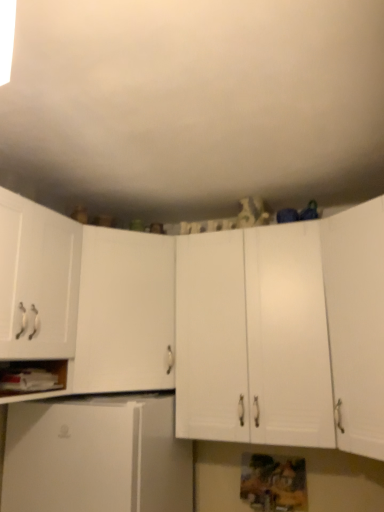
Question: Does white matte cabinet at lower left have a greater width compared to white matte cabinet at left, the third cabinetry from the left?

Choices:
 (A) no
 (B) yes

Answer: (A)

Question: Is white matte cabinet at lower left outside white matte cabinet at left, the third cabinetry from the left?

Choices:
 (A) yes
 (B) no

Answer: (A)

Question: Can you confirm if white matte cabinet at lower left is thinner than white matte cabinet at left, which ranks as the 3th cabinetry in right-to-left order?

Choices:
 (A) yes
 (B) no

Answer: (A)

Question: Is white matte cabinet at lower left closer to the viewer compared to white matte cabinet at left, which ranks as the 3th cabinetry in right-to-left order?

Choices:
 (A) yes
 (B) no

Answer: (A)

Question: Is white matte cabinet at lower left further to the viewer compared to white matte cabinet at left, the third cabinetry from the left?

Choices:
 (A) no
 (B) yes

Answer: (A)

Question: From the image's perspective, relative to white matte cabinet at left, placed as the first cabinetry when sorted from left to right, is white matte cabinet at right, marked as the 5th cabinetry in a left-to-right arrangement, above or below?

Choices:
 (A) above
 (B) below

Answer: (B)

Question: Is white matte cabinet at right, marked as the 5th cabinetry in a left-to-right arrangement, inside the boundaries of white matte cabinet at left, placed as the first cabinetry when sorted from left to right, or outside?

Choices:
 (A) outside
 (B) inside

Answer: (A)

Question: Looking at the image, does white matte cabinet at right, which appears as the first cabinetry when viewed from the right, seem bigger or smaller compared to white matte cabinet at left, placed as the first cabinetry when sorted from left to right?

Choices:
 (A) big
 (B) small

Answer: (A)

Question: From a real-world perspective, is white matte cabinet at right, which appears as the first cabinetry when viewed from the right, physically located above or below white matte cabinet at left, which is counted as the fifth cabinetry, starting from the right?

Choices:
 (A) below
 (B) above

Answer: (A)

Question: Would you say white matte cabinet at center, which is the second cabinetry in right-to-left order, is to the left or to the right of white matte refrigerator at lower left, which is counted as the fourth cabinetry, starting from the right, in the picture?

Choices:
 (A) right
 (B) left

Answer: (A)

Question: Considering the positions of white matte cabinet at center, the fourth cabinetry viewed from the left, and white matte refrigerator at lower left, marked as the 2th cabinetry in a left-to-right arrangement, in the image, is white matte cabinet at center, the fourth cabinetry viewed from the left, wider or thinner than white matte refrigerator at lower left, marked as the 2th cabinetry in a left-to-right arrangement,?

Choices:
 (A) thin
 (B) wide

Answer: (A)

Question: Considering their positions, is white matte cabinet at center, which is the second cabinetry in right-to-left order, located in front of or behind white matte refrigerator at lower left, marked as the 2th cabinetry in a left-to-right arrangement?

Choices:
 (A) behind
 (B) front

Answer: (A)

Question: Is white matte cabinet at center, which is the second cabinetry in right-to-left order, inside or outside of white matte refrigerator at lower left, marked as the 2th cabinetry in a left-to-right arrangement?

Choices:
 (A) inside
 (B) outside

Answer: (B)

Question: In terms of height, does white matte cabinet at right, marked as the 5th cabinetry in a left-to-right arrangement, look taller or shorter compared to white matte refrigerator at lower left, marked as the 2th cabinetry in a left-to-right arrangement?

Choices:
 (A) short
 (B) tall

Answer: (B)

Question: Is point click(x=367, y=386) closer or farther from the camera than point click(x=14, y=450)?

Choices:
 (A) farther
 (B) closer

Answer: (B)